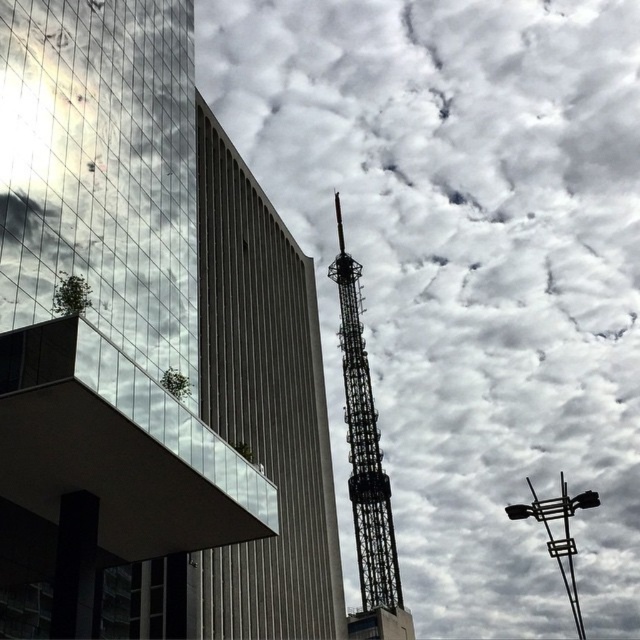
You are standing at the point marked by coordinates point (118,400) in the image. The modern glass building on the left has a reflective surface. Can you see the telecommunications tower in the center right through the reflection of the modern glass building on the left?

The point marked by coordinates point (118,400) is 123.41 feet away from the viewer. Since the modern glass building on the left is reflecting the cloudy sky and possibly the surrounding structures, it is possible that the telecommunications tower in the center right could be visible in its reflection depending on the angle and positioning. However, without specific information about the reflection angles or the building orientation, we cannot confirm visibility with certainty.

You are a city planner assessing the view from the rooftop of the modern glass building on the left. From this vantage point, does the metallic lattice tower at center appear to be partially hidden by the cloudy sky at upper center?

The cloudy sky at upper center is positioned over the metallic lattice tower at center, so yes, the tower is partially hidden by the sky from the rooftop of the modern glass building on the left.

You are standing in the urban scene and want to take a photo of both point (326, 356) and point (381, 596). Which point will appear closer to the camera in your photo?

Point (326, 356) is further to the camera than point (381, 596), so point (381, 596) will appear closer to the camera in the photo.